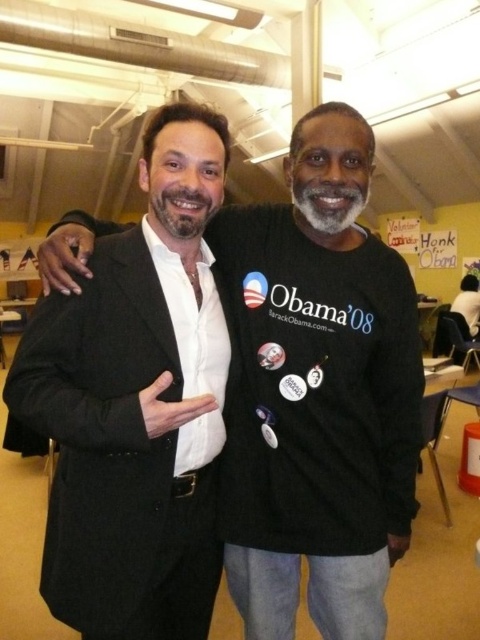
Between matte black suit at center and black matte suit at left, which one is positioned higher?

black matte suit at left

Who is more forward, (361,468) or (101,531)?

Point (101,531) is in front.

I want to click on matte black suit at center, so click(319, 392).